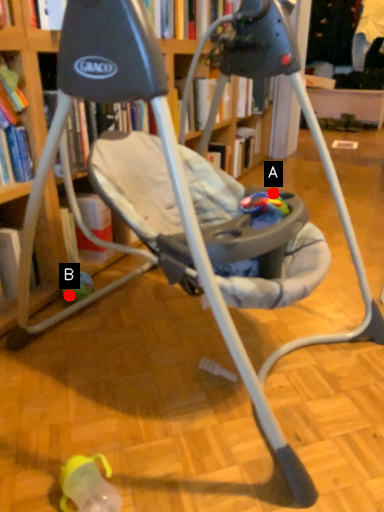
Question: Two points are circled on the image, labeled by A and B beside each circle. Which point is farther to the camera?

Choices:
 (A) A is further
 (B) B is further

Answer: (A)